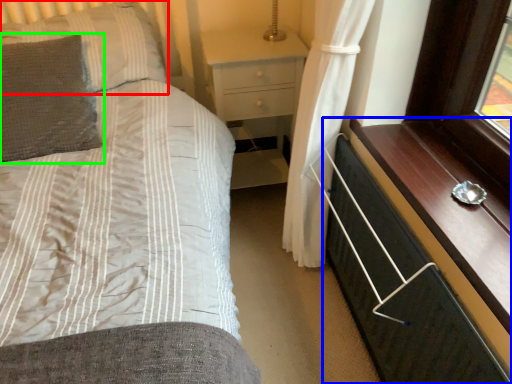
Question: Based on their relative distances, which object is nearer to pillow (highlighted by a red box)? Choose from chest of drawers (highlighted by a blue box) and pillow (highlighted by a green box).

Choices:
 (A) chest of drawers
 (B) pillow

Answer: (B)